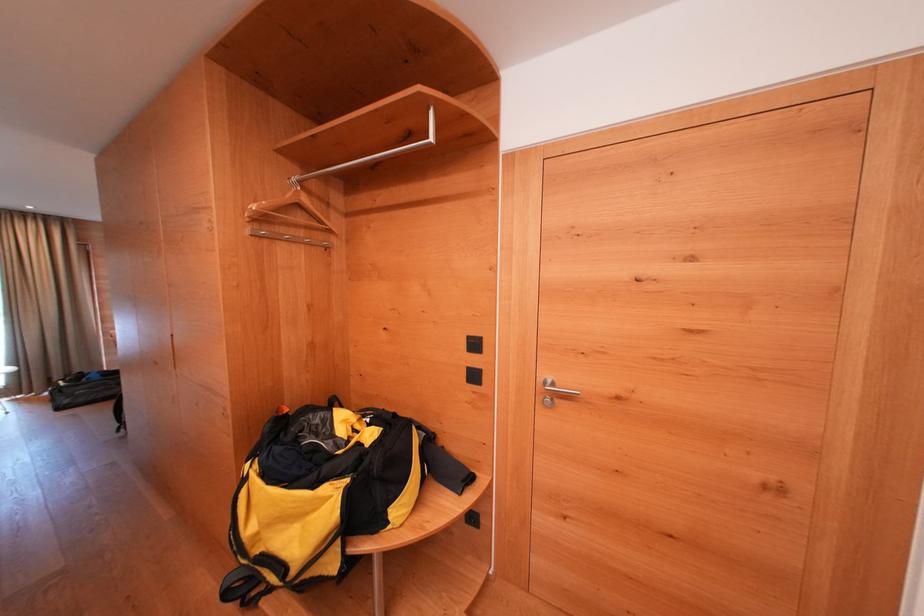
Describe the element at coordinates (371, 158) in the screenshot. I see `the metal clothes rod` at that location.